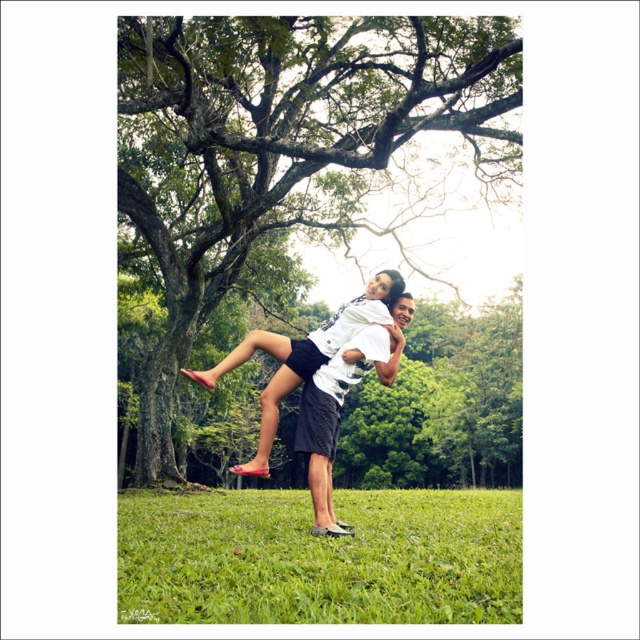
You are a photographer trying to capture a portrait of the matte white shirt at center. The green leafy tree at center is blocking your view. Can you determine if the tree is too big to move out of the way?

The green leafy tree at center is larger in size than matte white shirt at center. Since the tree is significantly bigger, it might be difficult to move it out of the way quickly for the portrait.